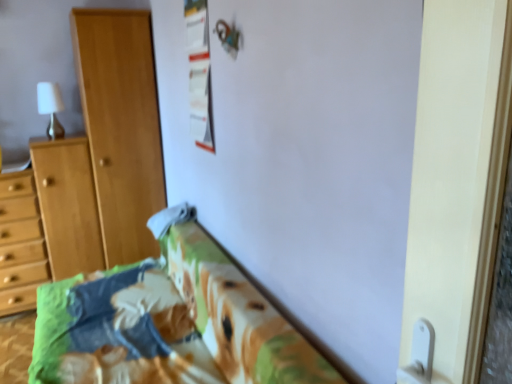
Describe the element at coordinates (457, 179) in the screenshot. I see `white glossy screen door at right` at that location.

In order to face light brown wooden cupboard at left, should I rotate leftwards or rightwards?

It's best to rotate left around 16.911 degrees.

I want to click on white matte lamp at upper left, so click(51, 108).

Describe the element at coordinates (51, 108) in the screenshot. The height and width of the screenshot is (384, 512). I see `white matte lamp at upper left` at that location.

Identify the location of white fabric pillow at lower center. Image resolution: width=512 pixels, height=384 pixels. (170, 218).

What do you see at coordinates (47, 221) in the screenshot? Image resolution: width=512 pixels, height=384 pixels. I see `light wood dresser at left` at bounding box center [47, 221].

This screenshot has width=512, height=384. Identify the location of printed fabric bedspread at lower center. (172, 320).

The width and height of the screenshot is (512, 384). I want to click on white glossy screen door at right, so click(457, 179).

Is point (169, 224) positioned in front of point (466, 294)?

No, (169, 224) is behind (466, 294).

Considering the relative sizes of white fabric pillow at lower center and white glossy screen door at right in the image provided, is white fabric pillow at lower center smaller than white glossy screen door at right?

Correct, white fabric pillow at lower center occupies less space than white glossy screen door at right.

Is white fabric pillow at lower center turned away from white glossy screen door at right?

No, white fabric pillow at lower center's orientation is not away from white glossy screen door at right.

From a real-world perspective, is white fabric pillow at lower center under white glossy screen door at right?

Indeed, from a real-world perspective, white fabric pillow at lower center is positioned beneath white glossy screen door at right.

Is printed fabric bedspread at lower center oriented away from white fabric pillow at lower center?

No, printed fabric bedspread at lower center is not facing away from white fabric pillow at lower center.

Is printed fabric bedspread at lower center spatially inside white fabric pillow at lower center, or outside of it?

printed fabric bedspread at lower center is located beyond the bounds of white fabric pillow at lower center.

Considering the points (236, 296) and (182, 216), which point is behind, point (236, 296) or point (182, 216)?

The point (182, 216) is farther.

Which of these two, light brown wooden cupboard at left or white fabric pillow at lower center, is bigger?

light brown wooden cupboard at left is bigger.

Does light brown wooden cupboard at left touch white fabric pillow at lower center?

No, light brown wooden cupboard at left is not making contact with white fabric pillow at lower center.

Considering the relative sizes of light brown wooden cupboard at left and white fabric pillow at lower center in the image provided, is light brown wooden cupboard at left taller than white fabric pillow at lower center?

Correct, light brown wooden cupboard at left is much taller as white fabric pillow at lower center.

Considering the sizes of objects light brown wooden cupboard at left and white fabric pillow at lower center in the image provided, who is wider, light brown wooden cupboard at left or white fabric pillow at lower center?

light brown wooden cupboard at left.

The image size is (512, 384). Find the location of `screen door located in front of the light wood dresser at left`. screen door located in front of the light wood dresser at left is located at coordinates (457, 179).

From a real-world perspective, is light wood dresser at left over white glossy screen door at right?

No, from a real-world perspective, light wood dresser at left is not on top of white glossy screen door at right.

Based on the photo, who is taller, light wood dresser at left or white glossy screen door at right?

Standing taller between the two is light wood dresser at left.

Does point (22, 176) lie behind point (472, 372)?

Yes, it is behind point (472, 372).

Is white fabric pillow at lower center smaller than white matte lamp at upper left?

Correct, white fabric pillow at lower center occupies less space than white matte lamp at upper left.

Are white fabric pillow at lower center and white matte lamp at upper left making contact?

white fabric pillow at lower center and white matte lamp at upper left are not in contact.

From a real-world perspective, who is located lower, white fabric pillow at lower center or white matte lamp at upper left?

In real-world perspective, white fabric pillow at lower center is lower.

Is white matte lamp at upper left completely or partially inside white fabric pillow at lower center?

Definitely not — white matte lamp at upper left is not inside white fabric pillow at lower center.

From the image's perspective, which is below, white fabric pillow at lower center or light wood dresser at left?

light wood dresser at left, from the image's perspective.

Can you see white fabric pillow at lower center touching light wood dresser at left?

white fabric pillow at lower center and light wood dresser at left are not in contact.

Is light wood dresser at left at the back of white fabric pillow at lower center?

That's not correct — white fabric pillow at lower center is not looking away from light wood dresser at left.

Between white fabric pillow at lower center and light wood dresser at left, which one is positioned in front?

white fabric pillow at lower center is more forward.

Is printed fabric bedspread at lower center facing towards light wood dresser at left?

No, printed fabric bedspread at lower center is not turned towards light wood dresser at left.

Where is `vanity that appears on the left of printed fabric bedspread at lower center`? This screenshot has width=512, height=384. vanity that appears on the left of printed fabric bedspread at lower center is located at coordinates (47, 221).

Is printed fabric bedspread at lower center beside light wood dresser at left?

No.

Locate an element on the screen. screen door above the white fabric pillow at lower center (from the image's perspective) is located at coordinates tap(457, 179).

You are a GUI agent. You are given a task and a screenshot of the screen. Output one action in this format:
    pyautogui.click(x=<x>, y=<y>)
    Task: Click on the pillow on the right of printed fabric bedspread at lower center
    
    Given the screenshot: What is the action you would take?
    tap(170, 218)

Estimate the real-world distances between objects in this image. Which object is further from white glossy screen door at right, white fabric pillow at lower center or light brown wooden cupboard at left?

Based on the image, light brown wooden cupboard at left appears to be further to white glossy screen door at right.

Consider the image. Considering their positions, is white glossy screen door at right positioned further to white fabric pillow at lower center than light brown wooden cupboard at left?

Among the two, white glossy screen door at right is located further to white fabric pillow at lower center.

When comparing their distances from printed fabric bedspread at lower center, does white fabric pillow at lower center or white glossy screen door at right seem further?

Among the two, white glossy screen door at right is located further to printed fabric bedspread at lower center.

Based on their spatial positions, is printed fabric bedspread at lower center or light brown wooden cupboard at left closer to light wood dresser at left?

light brown wooden cupboard at left is positioned closer to the anchor light wood dresser at left.

Considering their positions, is white matte lamp at upper left positioned closer to light brown wooden cupboard at left than printed fabric bedspread at lower center?

Based on the image, white matte lamp at upper left appears to be nearer to light brown wooden cupboard at left.

When comparing their distances from light wood dresser at left, does light brown wooden cupboard at left or white matte lamp at upper left seem closer?

The object closer to light wood dresser at left is light brown wooden cupboard at left.

Looking at the image, which one is located closer to white glossy screen door at right, white fabric pillow at lower center or white matte lamp at upper left?

Based on the image, white fabric pillow at lower center appears to be nearer to white glossy screen door at right.

Estimate the real-world distances between objects in this image. Which object is further from light brown wooden cupboard at left, printed fabric bedspread at lower center or white matte lamp at upper left?

Among the two, printed fabric bedspread at lower center is located further to light brown wooden cupboard at left.

Where is `furniture between white glossy screen door at right and light wood dresser at left from front to back`? furniture between white glossy screen door at right and light wood dresser at left from front to back is located at coordinates (172, 320).

Find the location of a particular element. The image size is (512, 384). cupboard between white matte lamp at upper left and light wood dresser at left in the up-down direction is located at coordinates (121, 126).

Find the location of a particular element. pillow between printed fabric bedspread at lower center and white matte lamp at upper left along the z-axis is located at coordinates (170, 218).

This screenshot has width=512, height=384. In order to click on pillow between printed fabric bedspread at lower center and light brown wooden cupboard at left from front to back in this screenshot , I will do `click(170, 218)`.